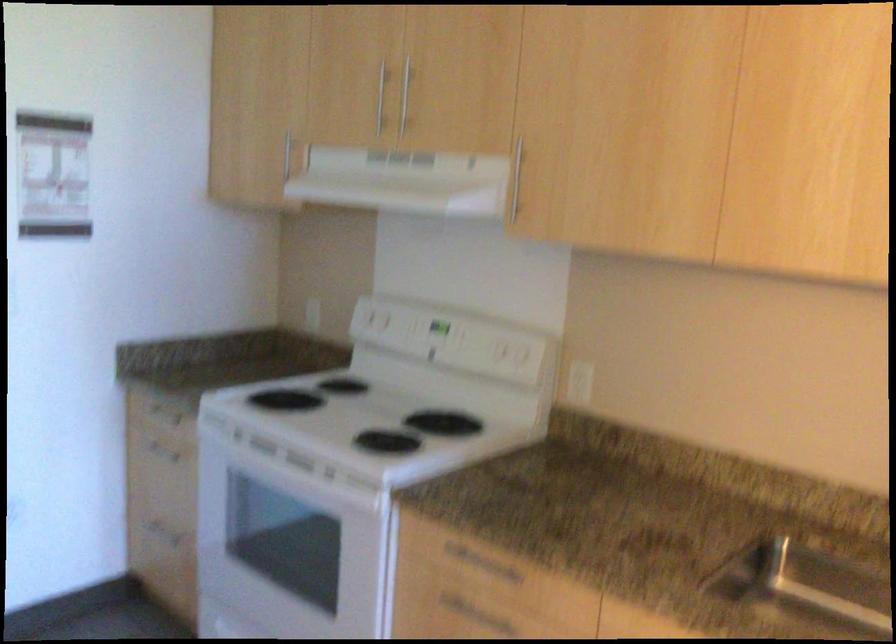
This screenshot has width=896, height=644. Find the location of `white oven handle`. white oven handle is located at coordinates (385, 571).